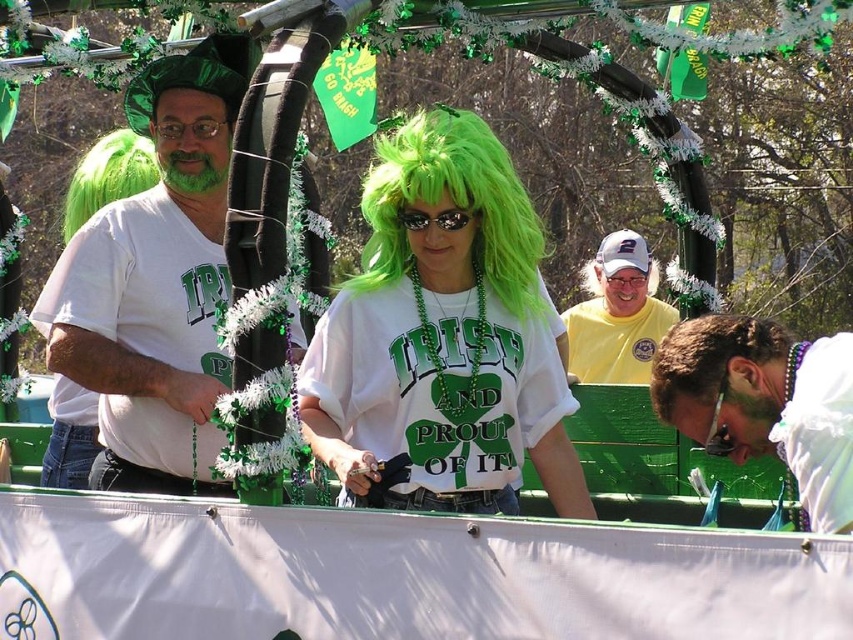
In the scene shown: Between green synthetic wig at upper left and black plastic sunglasses at center, which one has more height?

green synthetic wig at upper left is taller.

Locate an element on the screen. green synthetic wig at upper left is located at coordinates (107, 177).

This screenshot has height=640, width=853. I want to click on yellow cotton shirt at upper center, so click(618, 316).

This screenshot has height=640, width=853. Find the location of `yellow cotton shirt at upper center`. yellow cotton shirt at upper center is located at coordinates (618, 316).

Image resolution: width=853 pixels, height=640 pixels. Find the location of `yellow cotton shirt at upper center`. yellow cotton shirt at upper center is located at coordinates (618, 316).

Can you confirm if yellow cotton shirt at upper center is positioned to the right of black plastic sunglasses at center?

Indeed, yellow cotton shirt at upper center is positioned on the right side of black plastic sunglasses at center.

Measure the distance between yellow cotton shirt at upper center and camera.

yellow cotton shirt at upper center and camera are 30.79 meters apart from each other.

Which is in front, point (567, 371) or point (427, 212)?

Positioned in front is point (427, 212).

You are a GUI agent. You are given a task and a screenshot of the screen. Output one action in this format:
    pyautogui.click(x=<x>, y=<y>)
    Task: Click on the yellow cotton shirt at upper center
    The width and height of the screenshot is (853, 640).
    Given the screenshot: What is the action you would take?
    pyautogui.click(x=618, y=316)